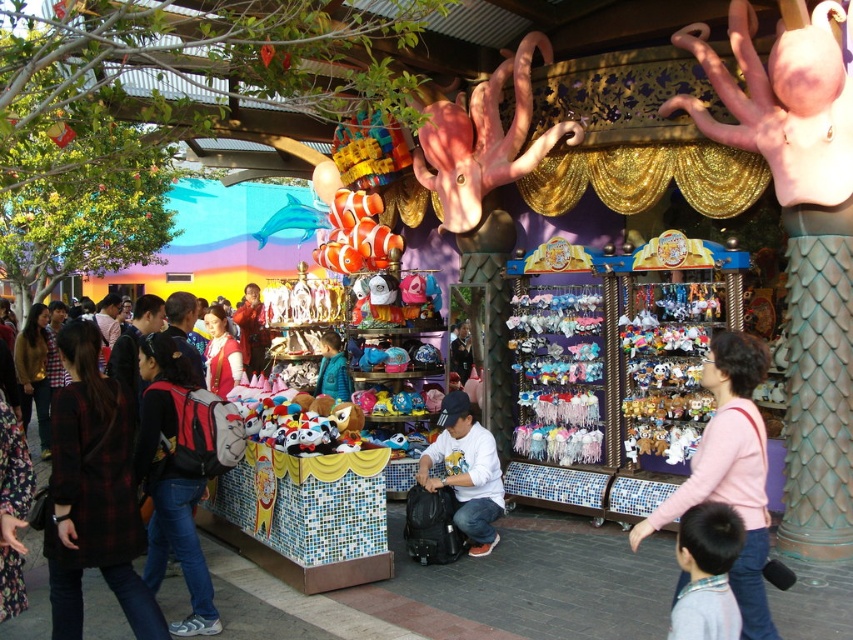
You are a visitor at the theme park and want to move from the red backpack at left to the pink fabric shirt at center. What is the approximate distance you need to cover?

The distance between the red backpack at left and the pink fabric shirt at center is 3.82 meters, so you need to cover approximately 3.82 meters.